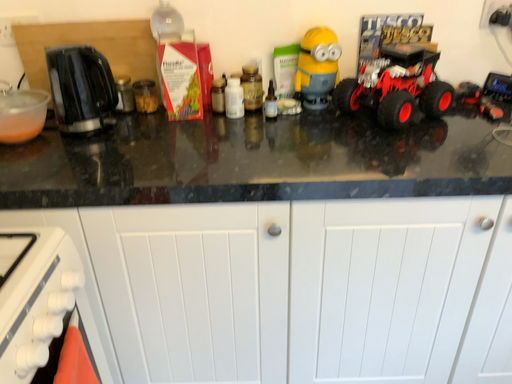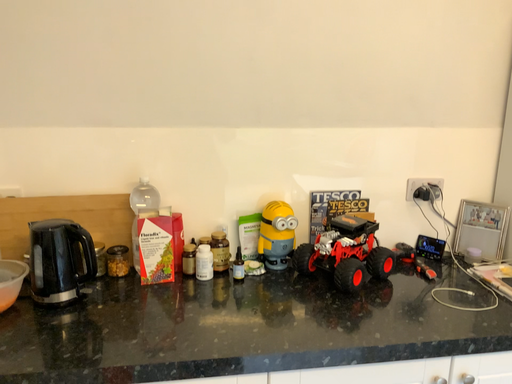
Question: How did the camera likely rotate when shooting the video?

Choices:
 (A) rotated downward
 (B) rotated upward

Answer: (B)